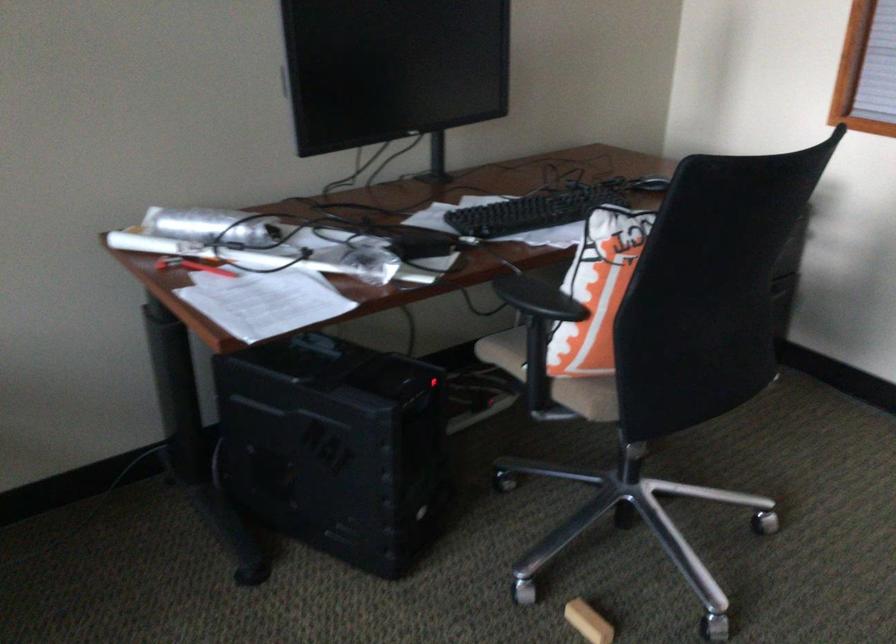
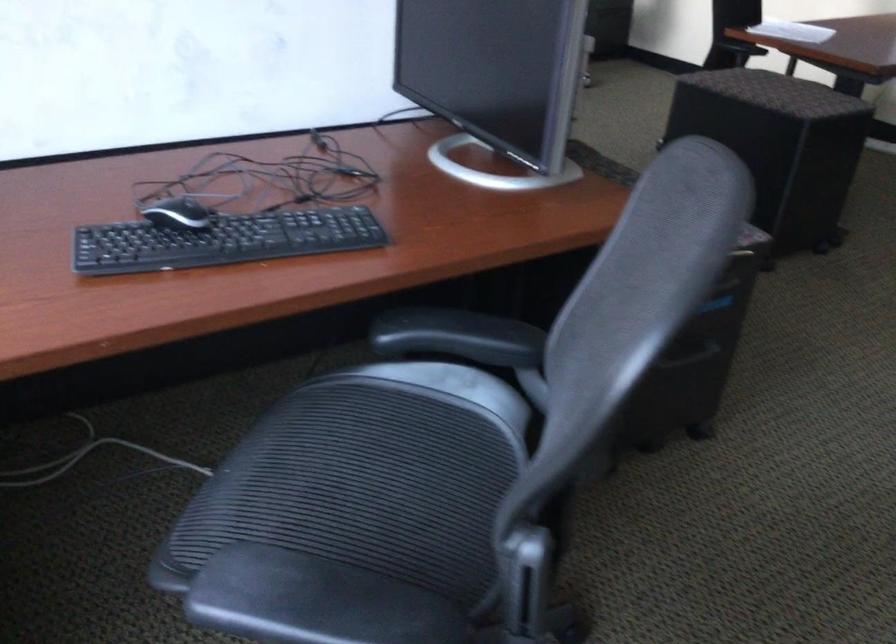
Question: In a continuous first-person perspective shot, in which direction is the camera moving?

Choices:
 (A) Left
 (B) Right
 (C) Forward
 (D) Backward

Answer: (D)